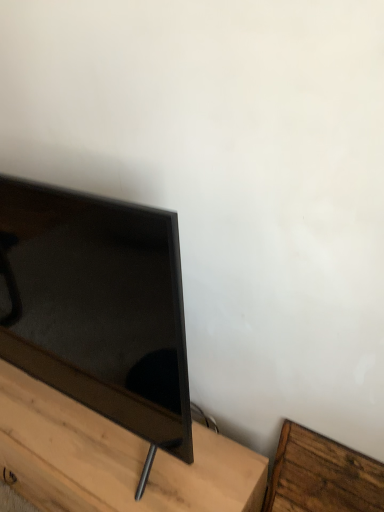
Question: Are wooden bed frame at lower right, arranged as the second furniture when viewed from the left, and matte black tv at left making contact?

Choices:
 (A) yes
 (B) no

Answer: (B)

Question: Is wooden bed frame at lower right, which is the 1th furniture from right to left, facing towards matte black tv at left?

Choices:
 (A) no
 (B) yes

Answer: (A)

Question: Is wooden bed frame at lower right, arranged as the second furniture when viewed from the left, taller than matte black tv at left?

Choices:
 (A) yes
 (B) no

Answer: (B)

Question: Does wooden bed frame at lower right, which is the 1th furniture from right to left, have a smaller size compared to matte black tv at left?

Choices:
 (A) no
 (B) yes

Answer: (B)

Question: Is wooden bed frame at lower right, which is the 1th furniture from right to left, bigger than matte black tv at left?

Choices:
 (A) yes
 (B) no

Answer: (B)

Question: From the image's perspective, is matte black tv stand at lower left, acting as the first furniture starting from the left, located above or below matte black tv at left?

Choices:
 (A) above
 (B) below

Answer: (B)

Question: Considering the relative positions of matte black tv stand at lower left, the 2th furniture in the right-to-left sequence, and matte black tv at left in the image provided, is matte black tv stand at lower left, the 2th furniture in the right-to-left sequence, to the left or to the right of matte black tv at left?

Choices:
 (A) right
 (B) left

Answer: (B)

Question: Relative to matte black tv at left, is matte black tv stand at lower left, the 2th furniture in the right-to-left sequence, in front or behind?

Choices:
 (A) behind
 (B) front

Answer: (A)

Question: Is point (11, 422) closer or farther from the camera than point (153, 356)?

Choices:
 (A) closer
 (B) farther

Answer: (B)

Question: In terms of size, does wooden bed frame at lower right, which is the 1th furniture from right to left, appear bigger or smaller than matte black tv at left?

Choices:
 (A) small
 (B) big

Answer: (A)

Question: From their relative heights in the image, would you say wooden bed frame at lower right, arranged as the second furniture when viewed from the left, is taller or shorter than matte black tv at left?

Choices:
 (A) short
 (B) tall

Answer: (A)

Question: In terms of width, does wooden bed frame at lower right, which is the 1th furniture from right to left, look wider or thinner when compared to matte black tv at left?

Choices:
 (A) thin
 (B) wide

Answer: (A)

Question: Would you say wooden bed frame at lower right, arranged as the second furniture when viewed from the left, is to the left or to the right of matte black tv at left in the picture?

Choices:
 (A) left
 (B) right

Answer: (B)

Question: In the image, is matte black tv stand at lower left, the 2th furniture in the right-to-left sequence, positioned in front of or behind wooden bed frame at lower right, which is the 1th furniture from right to left?

Choices:
 (A) front
 (B) behind

Answer: (A)

Question: Is matte black tv stand at lower left, the 2th furniture in the right-to-left sequence, spatially inside wooden bed frame at lower right, which is the 1th furniture from right to left, or outside of it?

Choices:
 (A) outside
 (B) inside

Answer: (A)